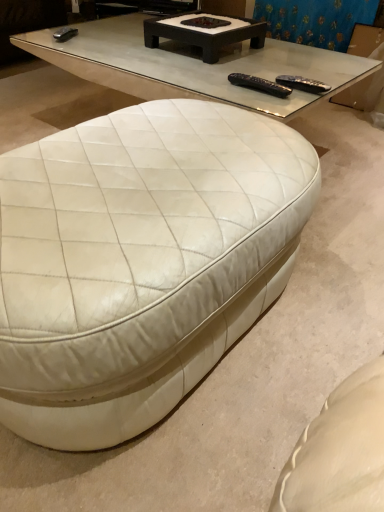
Describe the element at coordinates (302, 84) in the screenshot. I see `black plastic remote at upper right, the 1th remote from the right` at that location.

This screenshot has width=384, height=512. Find the location of `blue fabric curtain at upper center`. blue fabric curtain at upper center is located at coordinates (315, 20).

Describe the element at coordinates (259, 85) in the screenshot. The height and width of the screenshot is (512, 384). I see `black plastic remote at upper center, arranged as the second remote when viewed from the right` at that location.

Locate an element on the screen. This screenshot has height=512, width=384. dark brown wood coffee table at upper center, positioned as the second coffee table in bottom-to-top order is located at coordinates (205, 32).

Does point (102, 382) lie in front of point (281, 85)?

Yes, it is.

Considering the sizes of objects white leather ottoman at lower left, which is the 2th coffee table from top to bottom, and black plastic remote at upper center, the 1th remote viewed from the left, in the image provided, who is wider, white leather ottoman at lower left, which is the 2th coffee table from top to bottom, or black plastic remote at upper center, the 1th remote viewed from the left,?

Wider between the two is white leather ottoman at lower left, which is the 2th coffee table from top to bottom.

Is white leather ottoman at lower left, which is the 2th coffee table from top to bottom, placed right next to black plastic remote at upper center, arranged as the second remote when viewed from the right?

There is a gap between white leather ottoman at lower left, which is the 2th coffee table from top to bottom, and black plastic remote at upper center, arranged as the second remote when viewed from the right.

From the image's perspective, is white leather ottoman at lower left, placed as the 2th coffee table when sorted from back to front, beneath black plastic remote at upper center, arranged as the second remote when viewed from the right?

Indeed, from the image's perspective, white leather ottoman at lower left, placed as the 2th coffee table when sorted from back to front, is shown beneath black plastic remote at upper center, arranged as the second remote when viewed from the right.

Considering the sizes of black plastic remote at upper center, arranged as the second remote when viewed from the right, and white leather ottoman at lower left, placed as the 2th coffee table when sorted from back to front, in the image, is black plastic remote at upper center, arranged as the second remote when viewed from the right, bigger or smaller than white leather ottoman at lower left, placed as the 2th coffee table when sorted from back to front,?

black plastic remote at upper center, arranged as the second remote when viewed from the right, is smaller than white leather ottoman at lower left, placed as the 2th coffee table when sorted from back to front.

Looking at this image, which is correct: black plastic remote at upper center, the 1th remote viewed from the left, is inside white leather ottoman at lower left, which is the 2th coffee table from top to bottom, or outside of it?

black plastic remote at upper center, the 1th remote viewed from the left, is not enclosed by white leather ottoman at lower left, which is the 2th coffee table from top to bottom.

From the image's perspective, is black plastic remote at upper center, arranged as the second remote when viewed from the right, over white leather ottoman at lower left, placed as the 2th coffee table when sorted from back to front?

Indeed, from the image's perspective, black plastic remote at upper center, arranged as the second remote when viewed from the right, is shown above white leather ottoman at lower left, placed as the 2th coffee table when sorted from back to front.

Which of these two, black plastic remote at upper center, the 1th remote viewed from the left, or white leather ottoman at lower left, which is the 2th coffee table from top to bottom, stands shorter?

With less height is black plastic remote at upper center, the 1th remote viewed from the left.

This screenshot has width=384, height=512. In order to click on the 1st coffee table counting from the left side of the black plastic remote at upper right, which appears as the 2th remote when viewed from the left in this screenshot , I will do `click(205, 32)`.

Is black plastic remote at upper right, the 1th remote from the right, not close to dark brown wood coffee table at upper center, positioned as the second coffee table in bottom-to-top order?

No.

Considering the sizes of black plastic remote at upper right, which appears as the 2th remote when viewed from the left, and dark brown wood coffee table at upper center, which ranks as the 2th coffee table in front-to-back order, in the image, is black plastic remote at upper right, which appears as the 2th remote when viewed from the left, bigger or smaller than dark brown wood coffee table at upper center, which ranks as the 2th coffee table in front-to-back order,?

black plastic remote at upper right, which appears as the 2th remote when viewed from the left, is smaller than dark brown wood coffee table at upper center, which ranks as the 2th coffee table in front-to-back order.

Is black plastic remote at upper right, which appears as the 2th remote when viewed from the left, positioned behind dark brown wood coffee table at upper center, which ranks as the 2th coffee table in front-to-back order?

No.

Considering the sizes of blue fabric curtain at upper center and black plastic remote at upper right, which appears as the 2th remote when viewed from the left, in the image, is blue fabric curtain at upper center bigger or smaller than black plastic remote at upper right, which appears as the 2th remote when viewed from the left,?

In the image, blue fabric curtain at upper center appears to be larger than black plastic remote at upper right, which appears as the 2th remote when viewed from the left.

Is blue fabric curtain at upper center to the right of black plastic remote at upper right, the 1th remote from the right, from the viewer's perspective?

Yes, blue fabric curtain at upper center is to the right of black plastic remote at upper right, the 1th remote from the right.

Could you tell me if blue fabric curtain at upper center is facing black plastic remote at upper right, the 1th remote from the right?

Yes, blue fabric curtain at upper center is facing black plastic remote at upper right, the 1th remote from the right.

Relative to black plastic remote at upper right, which appears as the 2th remote when viewed from the left, is blue fabric curtain at upper center in front or behind?

In the image, blue fabric curtain at upper center appears behind black plastic remote at upper right, which appears as the 2th remote when viewed from the left.

Consider the image. Can you tell me how much black plastic remote at upper right, which appears as the 2th remote when viewed from the left, and black plastic remote at upper center, the 1th remote viewed from the left, differ in facing direction?

5.44 degrees separate the facing orientations of black plastic remote at upper right, which appears as the 2th remote when viewed from the left, and black plastic remote at upper center, the 1th remote viewed from the left.

Are black plastic remote at upper right, which appears as the 2th remote when viewed from the left, and black plastic remote at upper center, the 1th remote viewed from the left, located far from each other?

No, black plastic remote at upper right, which appears as the 2th remote when viewed from the left, is not far from black plastic remote at upper center, the 1th remote viewed from the left.

Between black plastic remote at upper right, the 1th remote from the right, and black plastic remote at upper center, the 1th remote viewed from the left, which one has larger size?

black plastic remote at upper right, the 1th remote from the right.

Considering the positions of objects black plastic remote at upper right, the 1th remote from the right, and black plastic remote at upper center, the 1th remote viewed from the left, in the image provided, who is more to the left, black plastic remote at upper right, the 1th remote from the right, or black plastic remote at upper center, the 1th remote viewed from the left,?

From the viewer's perspective, black plastic remote at upper center, the 1th remote viewed from the left, appears more on the left side.

From a real-world perspective, is black plastic remote at upper center, the 1th remote viewed from the left, located beneath black plastic remote at upper right, which appears as the 2th remote when viewed from the left?

No.

Is the position of black plastic remote at upper center, arranged as the second remote when viewed from the right, more distant than that of black plastic remote at upper right, the 1th remote from the right?

That is False.

Is black plastic remote at upper center, the 1th remote viewed from the left, facing away from black plastic remote at upper right, which appears as the 2th remote when viewed from the left?

Yes.

Is black plastic remote at upper center, arranged as the second remote when viewed from the right, inside or outside of black plastic remote at upper right, which appears as the 2th remote when viewed from the left?

The correct answer is: outside.

How distant is blue fabric curtain at upper center from dark brown wood coffee table at upper center, positioned as the second coffee table in bottom-to-top order?

blue fabric curtain at upper center and dark brown wood coffee table at upper center, positioned as the second coffee table in bottom-to-top order, are 35.75 inches apart from each other.

Based on their sizes in the image, would you say blue fabric curtain at upper center is bigger or smaller than dark brown wood coffee table at upper center, the 1th coffee table when ordered from back to front?

blue fabric curtain at upper center is bigger than dark brown wood coffee table at upper center, the 1th coffee table when ordered from back to front.

In terms of height, does blue fabric curtain at upper center look taller or shorter compared to dark brown wood coffee table at upper center, positioned as the second coffee table in bottom-to-top order?

In the image, blue fabric curtain at upper center appears to be taller than dark brown wood coffee table at upper center, positioned as the second coffee table in bottom-to-top order.

Is blue fabric curtain at upper center not close to dark brown wood coffee table at upper center, the first coffee table in the top-to-bottom sequence?

blue fabric curtain at upper center is near dark brown wood coffee table at upper center, the first coffee table in the top-to-bottom sequence, not far away.

You are a GUI agent. You are given a task and a screenshot of the screen. Output one action in this format:
    pyautogui.click(x=<x>, y=<y>)
    Task: Click on the coffee table below the black plastic remote at upper center, arranged as the second remote when viewed from the right (from the image's perspective)
    The image size is (384, 512).
    Given the screenshot: What is the action you would take?
    pyautogui.click(x=139, y=261)

Which coffee table is the 2nd one when counting from the left side of the black plastic remote at upper center, the 1th remote viewed from the left? Please provide its 2D coordinates.

[(139, 261)]

Estimate the real-world distances between objects in this image. Which object is further from dark brown wood coffee table at upper center, which ranks as the 2th coffee table in front-to-back order, black plastic remote at upper right, which appears as the 2th remote when viewed from the left, or black plastic remote at upper center, the 1th remote viewed from the left?

black plastic remote at upper right, which appears as the 2th remote when viewed from the left, is further to dark brown wood coffee table at upper center, which ranks as the 2th coffee table in front-to-back order.

Estimate the real-world distances between objects in this image. Which object is closer to black plastic remote at upper right, the 1th remote from the right, white leather ottoman at lower left, which is the 2th coffee table from top to bottom, or blue fabric curtain at upper center?

The object closer to black plastic remote at upper right, the 1th remote from the right, is white leather ottoman at lower left, which is the 2th coffee table from top to bottom.

Based on their spatial positions, is blue fabric curtain at upper center or white leather ottoman at lower left, which ranks as the 1th coffee table in bottom-to-top order, further from dark brown wood coffee table at upper center, the first coffee table in the top-to-bottom sequence?

white leather ottoman at lower left, which ranks as the 1th coffee table in bottom-to-top order, is positioned further to the anchor dark brown wood coffee table at upper center, the first coffee table in the top-to-bottom sequence.

Considering their positions, is dark brown wood coffee table at upper center, which ranks as the 2th coffee table in front-to-back order, positioned closer to black plastic remote at upper center, arranged as the second remote when viewed from the right, than black plastic remote at upper right, which appears as the 2th remote when viewed from the left?

black plastic remote at upper right, which appears as the 2th remote when viewed from the left, lies closer to black plastic remote at upper center, arranged as the second remote when viewed from the right, than the other object.

From the picture: When comparing their distances from dark brown wood coffee table at upper center, which ranks as the 2th coffee table in front-to-back order, does white leather ottoman at lower left, which ranks as the 1th coffee table in bottom-to-top order, or black plastic remote at upper right, which appears as the 2th remote when viewed from the left, seem further?

white leather ottoman at lower left, which ranks as the 1th coffee table in bottom-to-top order, is further to dark brown wood coffee table at upper center, which ranks as the 2th coffee table in front-to-back order.

Which object lies nearer to the anchor point dark brown wood coffee table at upper center, which ranks as the 2th coffee table in front-to-back order, black plastic remote at upper right, which appears as the 2th remote when viewed from the left, or white leather ottoman at lower left, which is the 2th coffee table from top to bottom?

Among the two, black plastic remote at upper right, which appears as the 2th remote when viewed from the left, is located nearer to dark brown wood coffee table at upper center, which ranks as the 2th coffee table in front-to-back order.

When comparing their distances from black plastic remote at upper right, the 1th remote from the right, does blue fabric curtain at upper center or white leather ottoman at lower left, which is the 2th coffee table from top to bottom, seem closer?

white leather ottoman at lower left, which is the 2th coffee table from top to bottom.

Based on the photo, looking at the image, which one is located closer to white leather ottoman at lower left, which is the 2th coffee table from top to bottom, black plastic remote at upper right, which appears as the 2th remote when viewed from the left, or blue fabric curtain at upper center?

black plastic remote at upper right, which appears as the 2th remote when viewed from the left, is closer to white leather ottoman at lower left, which is the 2th coffee table from top to bottom.

Locate an element on the screen. remote between dark brown wood coffee table at upper center, the 1th coffee table when ordered from back to front, and black plastic remote at upper center, the 1th remote viewed from the left, in the up-down direction is located at coordinates (302, 84).

Locate an element on the screen. The width and height of the screenshot is (384, 512). coffee table located between black plastic remote at upper right, the 1th remote from the right, and blue fabric curtain at upper center in the depth direction is located at coordinates (205, 32).

You are a GUI agent. You are given a task and a screenshot of the screen. Output one action in this format:
    pyautogui.click(x=<x>, y=<y>)
    Task: Click on the coffee table between white leather ottoman at lower left, placed as the 2th coffee table when sorted from back to front, and blue fabric curtain at upper center from front to back
    This screenshot has height=512, width=384.
    Given the screenshot: What is the action you would take?
    pyautogui.click(x=205, y=32)

I want to click on remote between black plastic remote at upper center, arranged as the second remote when viewed from the right, and blue fabric curtain at upper center, along the z-axis, so click(302, 84).